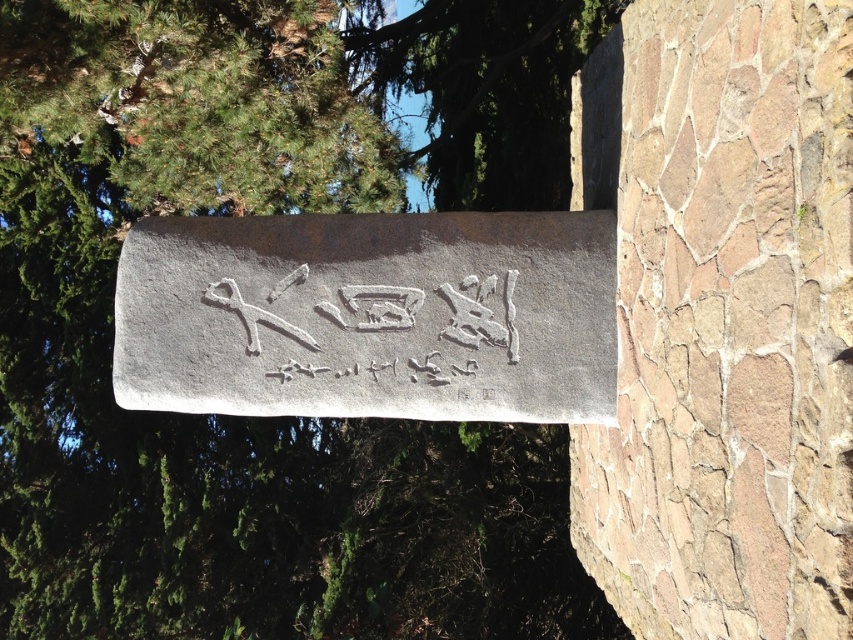
You are standing in front of the stone monument and want to locate two specific points marked on it. The first point is at coordinate point(416, 273) and the second is at point(543, 109). Which of these two points is closer to you?

Point(416, 273) is in front of point(543, 109), so the first point is closer to you.

Based on the provided scene description, what object is located at the coordinates point (370, 316)?

The point (370, 316) corresponds to the white stone sign at center.